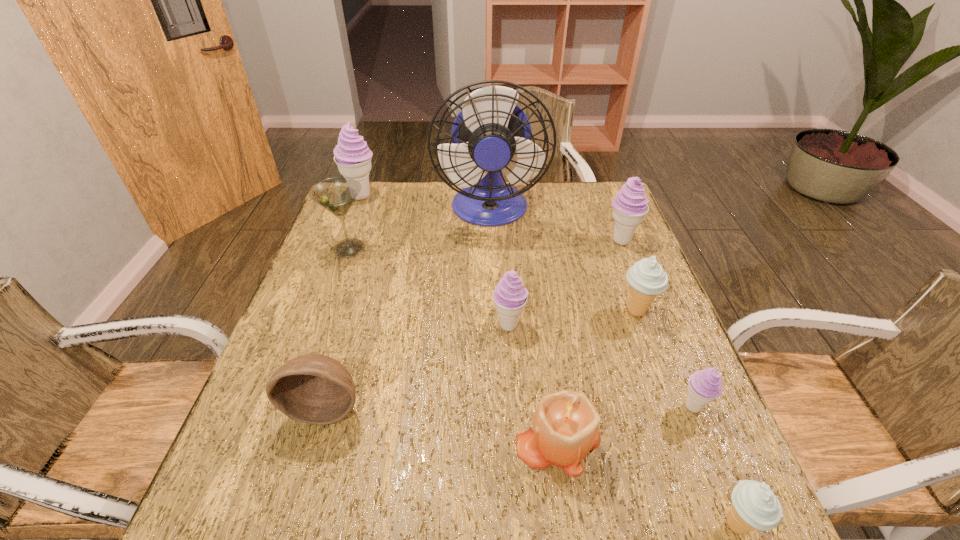
Find the location of a particular element. This screenshot has width=960, height=540. free space that is in between the fan and the martini is located at coordinates (420, 230).

Find the location of a particular element. vacant area that lies between the beige candle and the second purple icecream from left to right is located at coordinates (534, 382).

At what (x,y) coordinates should I click in order to perform the action: click on unoccupied position between the candle and the farther beige icecream. Please return your answer as a coordinate pair (x, y). The image size is (960, 540). Looking at the image, I should click on (597, 375).

You are a GUI agent. You are given a task and a screenshot of the screen. Output one action in this format:
    pyautogui.click(x=<x>, y=<y>)
    Task: Click on the unoccupied area between the farther beige icecream and the bowl
    The image size is (960, 540).
    Given the screenshot: What is the action you would take?
    pyautogui.click(x=481, y=359)

Where is `vacant area between the candle and the third purple icecream from right to left`? The height and width of the screenshot is (540, 960). vacant area between the candle and the third purple icecream from right to left is located at coordinates (534, 382).

Locate an element on the screen. The width and height of the screenshot is (960, 540). object that is the eighth nearest to the second smallest purple icecream is located at coordinates (754, 506).

Identify the location of the sixth closest object to the nearest icecream. The height and width of the screenshot is (540, 960). (630, 206).

Locate an element on the screen. icecream that is the fifth closest to the martini is located at coordinates (704, 386).

Where is `the third closest icecream relative to the candle`? This screenshot has width=960, height=540. the third closest icecream relative to the candle is located at coordinates (510, 296).

Image resolution: width=960 pixels, height=540 pixels. In order to click on purple icecream identified as the second closest to the second nearest purple icecream in this screenshot , I will do `click(630, 206)`.